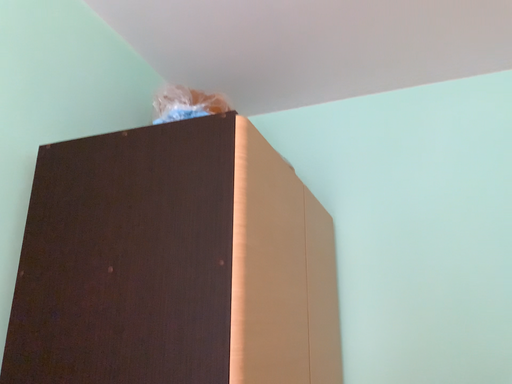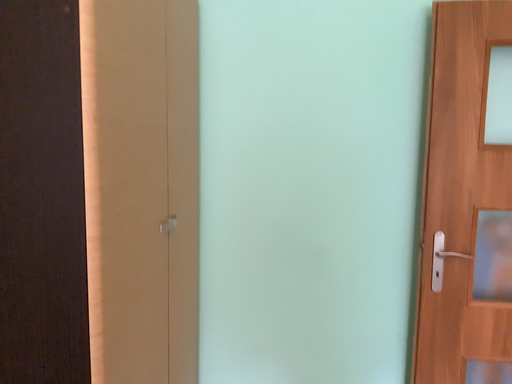
Question: How did the camera likely rotate when shooting the video?

Choices:
 (A) rotated upward
 (B) rotated downward

Answer: (B)